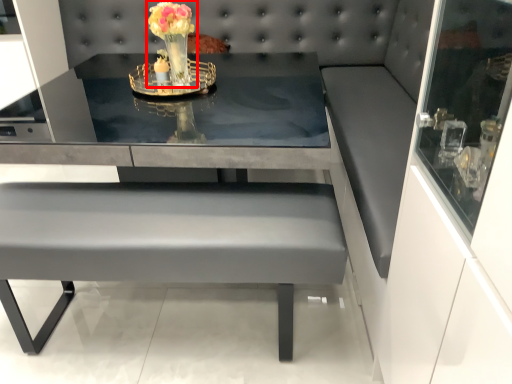
Question: From the image's perspective, considering the relative positions of floral arrangement (annotated by the red box) and table in the image provided, where is floral arrangement (annotated by the red box) located with respect to the staircase?

Choices:
 (A) below
 (B) above

Answer: (B)